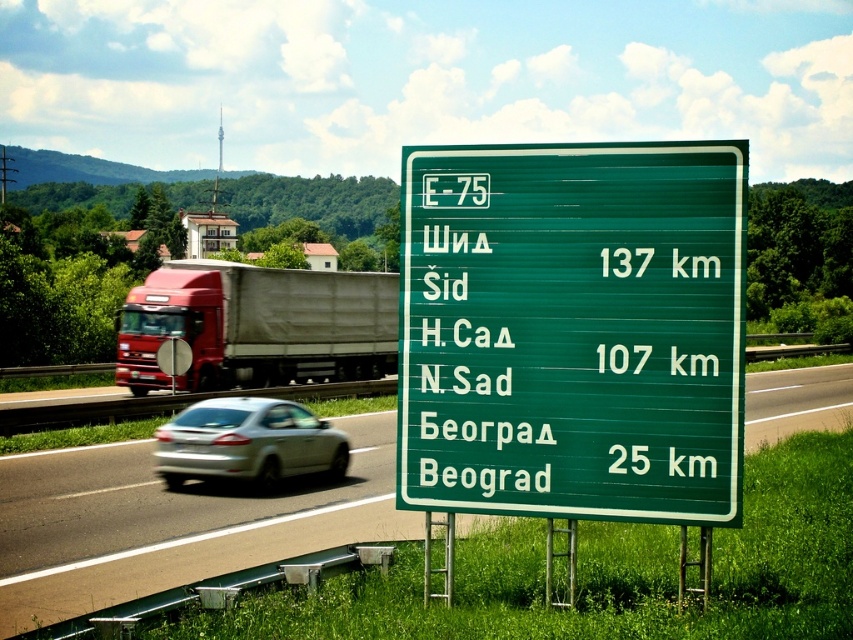
Question: Does red matte trailer truck at left have a smaller size compared to silver metallic sedan at center?

Choices:
 (A) no
 (B) yes

Answer: (A)

Question: Estimate the real-world distances between objects in this image. Which object is farther from the green signpost at center?

Choices:
 (A) green plastic sign at center
 (B) silver metallic sedan at center

Answer: (A)

Question: Which point is farther to the camera?

Choices:
 (A) red matte trailer truck at left
 (B) silver metallic sedan at center
 (C) green plastic sign at center

Answer: (A)

Question: Can you confirm if green signpost at center is thinner than red matte trailer truck at left?

Choices:
 (A) yes
 (B) no

Answer: (B)

Question: Does red matte trailer truck at left appear on the left side of silver metallic sedan at center?

Choices:
 (A) yes
 (B) no

Answer: (A)

Question: Which object is the closest to the green plastic sign at center?

Choices:
 (A) red matte trailer truck at left
 (B) silver metallic sedan at center

Answer: (B)